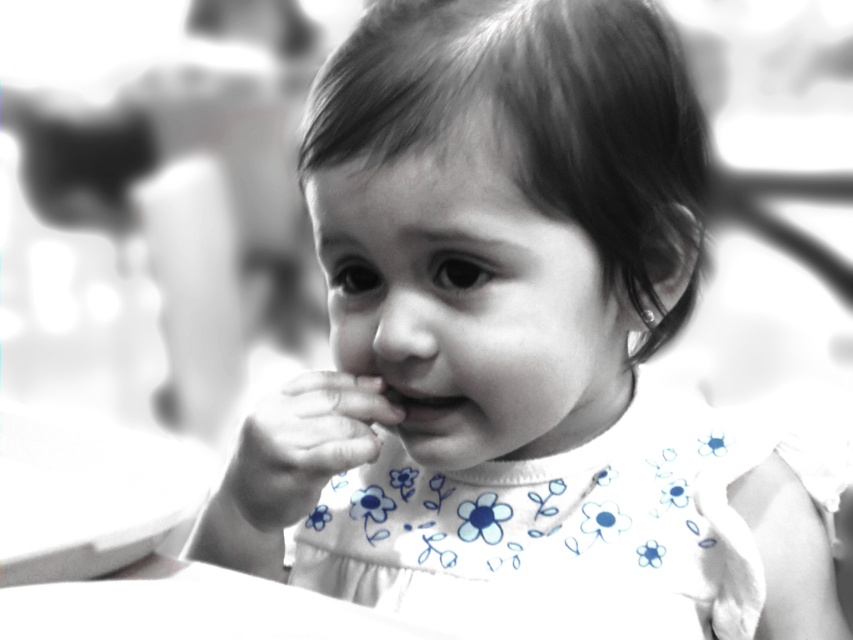
Can you confirm if smooth skin hand at center is positioned below smooth skin mouth at center?

Yes.

How much distance is there between smooth skin hand at center and smooth skin mouth at center?

1.60 inches

At what (x,y) coordinates should I click in order to perform the action: click on smooth skin hand at center. Please return your answer as a coordinate pair (x, y). The width and height of the screenshot is (853, 640). Looking at the image, I should click on (300, 445).